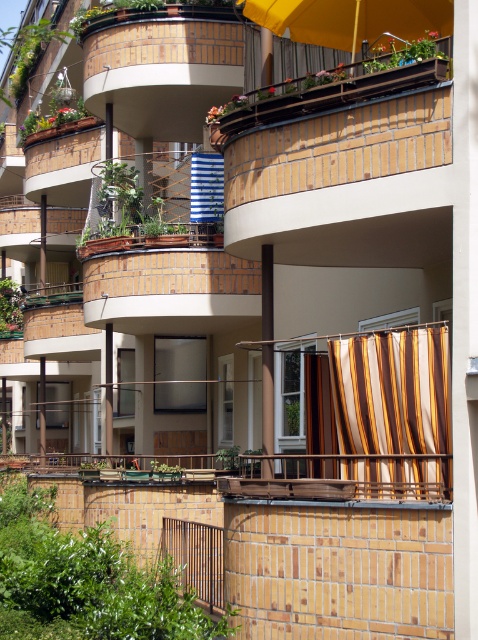
Question: Is brown striped curtain at center bigger than blue striped fabric at upper center?

Choices:
 (A) yes
 (B) no

Answer: (A)

Question: Does striped fabric curtain at lower right appear over brown striped curtain at center?

Choices:
 (A) yes
 (B) no

Answer: (A)

Question: From the image, what is the correct spatial relationship of wooden railing at upper center in relation to yellow fabric umbrella at upper center?

Choices:
 (A) left
 (B) right

Answer: (A)

Question: Which is farther from the brown striped curtain at center?

Choices:
 (A) striped fabric curtain at lower right
 (B) blue striped fabric at upper center
 (C) yellow fabric umbrella at upper center
 (D) wooden railing at upper center

Answer: (B)

Question: Which point is farther to the camera?

Choices:
 (A) 358,483
 (B) 223,186
 (C) 419,17

Answer: (B)

Question: Estimate the real-world distances between objects in this image. Which object is farther from the striped fabric curtain at lower right?

Choices:
 (A) brown striped curtain at center
 (B) yellow fabric umbrella at upper center
 (C) wooden railing at upper center
 (D) blue striped fabric at upper center

Answer: (D)